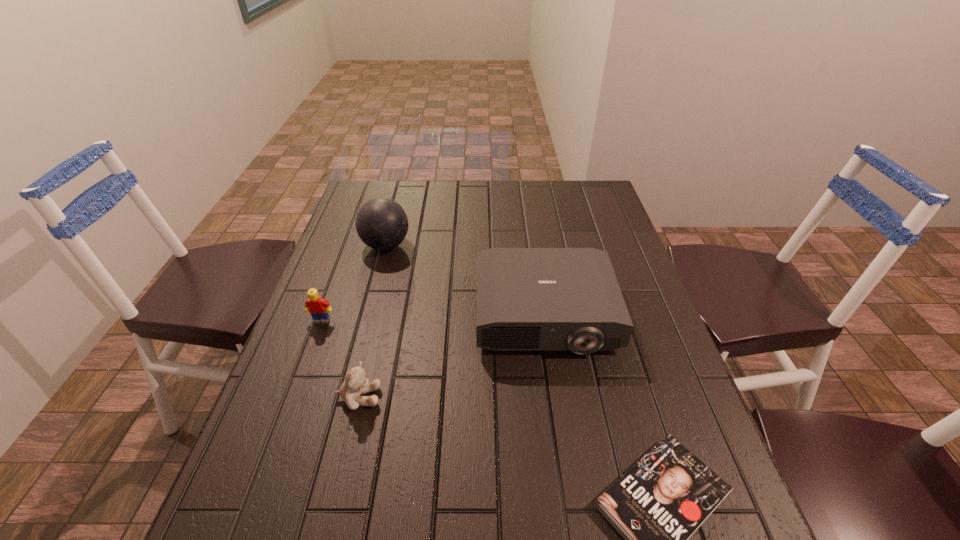
Locate an element on the screen. Image resolution: width=960 pixels, height=540 pixels. Lego positioned at the left edge is located at coordinates pyautogui.click(x=318, y=307).

At what (x,y) coordinates should I click in order to perform the action: click on teddy bear at the left edge. Please return your answer as a coordinate pair (x, y). The image size is (960, 540). Looking at the image, I should click on (356, 382).

The height and width of the screenshot is (540, 960). Identify the location of object that is at the right edge. (528, 299).

In order to click on free region at the far edge of the desktop in this screenshot , I will do `click(499, 187)`.

The height and width of the screenshot is (540, 960). In the image, there is a desktop. Find the location of `free region at the left edge`. free region at the left edge is located at coordinates (279, 394).

This screenshot has width=960, height=540. I want to click on vacant space at the right edge, so click(638, 381).

Where is `vacant space at the far right corner`? vacant space at the far right corner is located at coordinates (582, 211).

Locate an element on the screen. The width and height of the screenshot is (960, 540). empty space that is in between the leftmost object and the teddy bear is located at coordinates (340, 359).

Where is `vacant area between the teddy bear and the tallest object`? vacant area between the teddy bear and the tallest object is located at coordinates (372, 321).

Where is `blank region between the teddy bear and the leftmost object`? blank region between the teddy bear and the leftmost object is located at coordinates (340, 359).